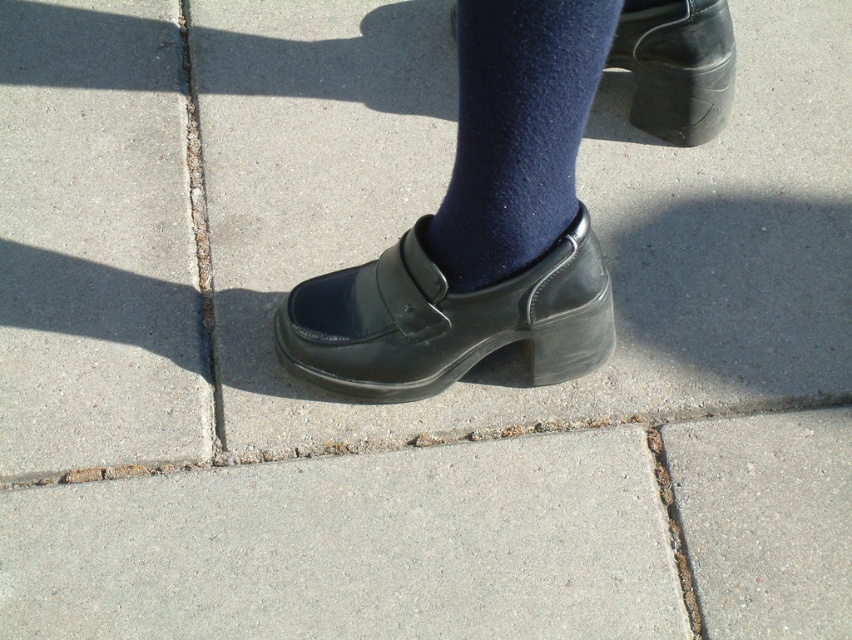
Question: Among these points, which one is nearest to the camera?

Choices:
 (A) 554,74
 (B) 537,317

Answer: (A)

Question: Does navy woolen sock at center appear under black leather shoe at upper right?

Choices:
 (A) yes
 (B) no

Answer: (A)

Question: Among these objects, which one is farthest from the camera?

Choices:
 (A) navy woolen sock at center
 (B) black leather shoe at upper right

Answer: (B)

Question: Does black leather shoe at center lie behind black leather shoe at upper right?

Choices:
 (A) yes
 (B) no

Answer: (B)

Question: Which object is the farthest from the black leather shoe at center?

Choices:
 (A) black leather shoe at upper right
 (B) navy woolen sock at center

Answer: (A)

Question: Where is black leather shoe at center located in relation to navy woolen sock at center in the image?

Choices:
 (A) below
 (B) above

Answer: (A)